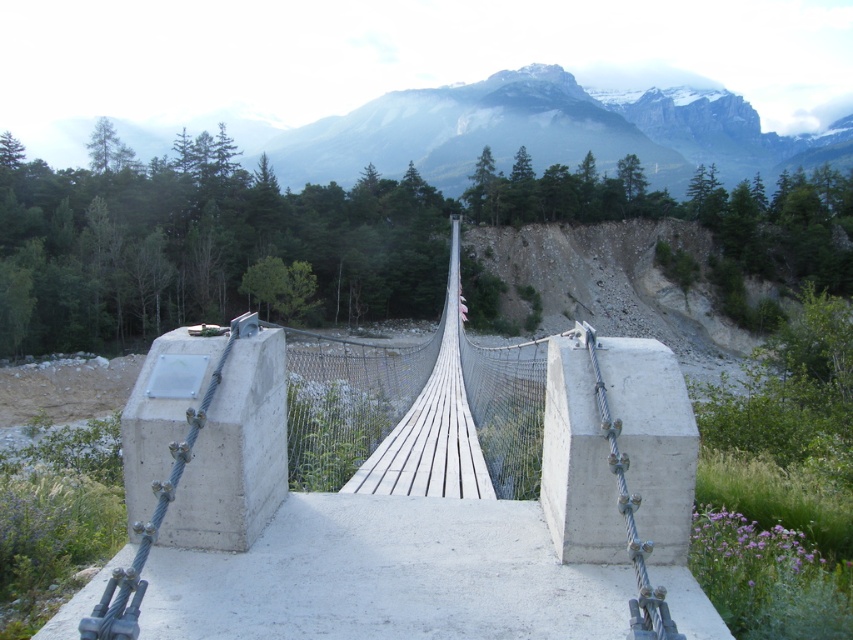
Does white concrete suspension bridge at center have a larger size compared to gray rocky mountain at upper center?

Actually, white concrete suspension bridge at center might be smaller than gray rocky mountain at upper center.

Is white concrete suspension bridge at center closer to the viewer compared to gray rocky mountain at upper center?

Yes.

Measure the distance between white concrete suspension bridge at center and camera.

2.21 meters

You are a GUI agent. You are given a task and a screenshot of the screen. Output one action in this format:
    pyautogui.click(x=<x>, y=<y>)
    Task: Click on the white concrete suspension bridge at center
    This screenshot has width=853, height=640.
    Given the screenshot: What is the action you would take?
    pyautogui.click(x=392, y=516)